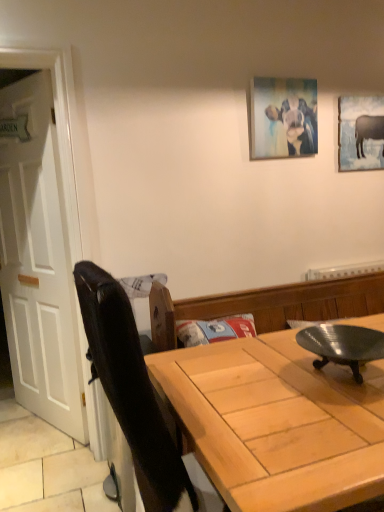
What do you see at coordinates (283, 118) in the screenshot? Image resolution: width=384 pixels, height=512 pixels. I see `matte canvas painting at upper center, acting as the 1th picture frame starting from the front` at bounding box center [283, 118].

This screenshot has height=512, width=384. Describe the element at coordinates (360, 133) in the screenshot. I see `matte gray cow at upper right, the second picture frame in the left-to-right sequence` at that location.

Image resolution: width=384 pixels, height=512 pixels. Find the location of `matte canvas painting at upper center, positioned as the 1th picture frame in left-to-right order`. matte canvas painting at upper center, positioned as the 1th picture frame in left-to-right order is located at coordinates (283, 118).

The image size is (384, 512). I want to click on desk on the right of white wooden door at left, so click(277, 423).

From a real-world perspective, which is physically above, white wooden door at left or light wood table at center?

white wooden door at left.

Does white wooden door at left have a larger size compared to light wood table at center?

No, white wooden door at left is not bigger than light wood table at center.

Is the surface of white wooden door at left in direct contact with light wood table at center?

There is a gap between white wooden door at left and light wood table at center.

Would you say metallic silver plate at center is inside or outside matte gray cow at upper right, the first picture frame from the right?

metallic silver plate at center is located beyond the bounds of matte gray cow at upper right, the first picture frame from the right.

Which object is more forward, metallic silver plate at center or matte gray cow at upper right, which appears as the second picture frame when viewed from the front?

metallic silver plate at center.

Can you confirm if metallic silver plate at center is positioned to the left of matte gray cow at upper right, the 1th picture frame in the back-to-front sequence?

Yes, metallic silver plate at center is to the left of matte gray cow at upper right, the 1th picture frame in the back-to-front sequence.

From the image's perspective, between metallic silver plate at center and matte gray cow at upper right, the first picture frame from the right, who is located below?

metallic silver plate at center, from the image's perspective.

In the scene shown: Does metallic silver plate at center turn towards light wood table at center?

No, metallic silver plate at center is not turned towards light wood table at center.

Could light wood table at center be considered to be inside metallic silver plate at center?

No, light wood table at center is located outside of metallic silver plate at center.

From the picture: Considering the sizes of objects metallic silver plate at center and light wood table at center in the image provided, who is shorter, metallic silver plate at center or light wood table at center?

Standing shorter between the two is metallic silver plate at center.

In terms of width, does metallic silver plate at center look wider or thinner when compared to light wood table at center?

In the image, metallic silver plate at center appears to be more narrow than light wood table at center.

Is matte gray cow at upper right, the 1th picture frame in the back-to-front sequence, at the back of white wooden door at left?

white wooden door at left is not turned away from matte gray cow at upper right, the 1th picture frame in the back-to-front sequence.

From the image's perspective, would you say white wooden door at left is shown under matte gray cow at upper right, which appears as the second picture frame when viewed from the front?

Yes.

Based on the photo, who is taller, white wooden door at left or matte gray cow at upper right, the first picture frame from the right?

white wooden door at left.

How many degrees apart are the facing directions of light wood table at center and metallic silver plate at center?

1.93 degrees.

Is point (298, 502) positioned in front of point (339, 324)?

Yes.

Is light wood table at center with metallic silver plate at center?

No, light wood table at center is not with metallic silver plate at center.

Looking at this image, from a real-world perspective, which object stands above the other?

From a 3D spatial view, metallic silver plate at center is above.

Looking at this image, can you confirm if light wood table at center is bigger than white wooden door at left?

Yes, light wood table at center is bigger than white wooden door at left.

From the image's perspective, does light wood table at center appear higher than white wooden door at left?

No, from the image's perspective, light wood table at center is not on top of white wooden door at left.

In the scene shown: Is light wood table at center far away from white wooden door at left?

Yes.

Does light wood table at center lie behind white wooden door at left?

No, it is not.

Locate an element on the screen. This screenshot has width=384, height=512. round table below the matte canvas painting at upper center, acting as the 1th picture frame starting from the front (from the image's perspective) is located at coordinates (342, 345).

How many degrees apart are the facing directions of metallic silver plate at center and matte canvas painting at upper center, positioned as the 2th picture frame in right-to-left order?

The angular difference between metallic silver plate at center and matte canvas painting at upper center, positioned as the 2th picture frame in right-to-left order, is 0.257 degrees.

From the image's perspective, which one is positioned higher, metallic silver plate at center or matte canvas painting at upper center, acting as the 1th picture frame starting from the front?

matte canvas painting at upper center, acting as the 1th picture frame starting from the front.

What are the coordinates of `desk in front of the white wooden door at left` in the screenshot? It's located at (277, 423).

What are the coordinates of `round table located on the left of matte gray cow at upper right, the first picture frame from the right` in the screenshot? It's located at (342, 345).

Which object lies nearer to the anchor point white wooden door at left, light wood table at center or matte gray cow at upper right, the second picture frame in the left-to-right sequence?

light wood table at center.

When comparing their distances from matte canvas painting at upper center, marked as the 2th picture frame in a back-to-front arrangement, does metallic silver plate at center or light wood table at center seem closer?

metallic silver plate at center lies closer to matte canvas painting at upper center, marked as the 2th picture frame in a back-to-front arrangement, than the other object.

Consider the image. Looking at the image, which one is located closer to matte gray cow at upper right, the 1th picture frame in the back-to-front sequence, light wood table at center or matte canvas painting at upper center, marked as the 2th picture frame in a back-to-front arrangement?

matte canvas painting at upper center, marked as the 2th picture frame in a back-to-front arrangement, is positioned closer to the anchor matte gray cow at upper right, the 1th picture frame in the back-to-front sequence.

Looking at the image, which one is located further to metallic silver plate at center, white wooden door at left or matte gray cow at upper right, the second picture frame in the left-to-right sequence?

Based on the image, white wooden door at left appears to be further to metallic silver plate at center.

When comparing their distances from light wood table at center, does metallic silver plate at center or matte gray cow at upper right, the 1th picture frame in the back-to-front sequence, seem closer?

metallic silver plate at center.

From the image, which object appears to be nearer to metallic silver plate at center, light wood table at center or matte canvas painting at upper center, marked as the 2th picture frame in a back-to-front arrangement?

light wood table at center.

Estimate the real-world distances between objects in this image. Which object is further from matte gray cow at upper right, the first picture frame from the right, matte canvas painting at upper center, marked as the 2th picture frame in a back-to-front arrangement, or light wood table at center?

light wood table at center is positioned further to the anchor matte gray cow at upper right, the first picture frame from the right.

From the image, which object appears to be farther from white wooden door at left, light wood table at center or matte canvas painting at upper center, marked as the 2th picture frame in a back-to-front arrangement?

light wood table at center lies further to white wooden door at left than the other object.

Locate an element on the screen. The width and height of the screenshot is (384, 512). desk between white wooden door at left and matte gray cow at upper right, the 1th picture frame in the back-to-front sequence, from left to right is located at coordinates (277, 423).

Find the location of a particular element. The image size is (384, 512). round table between light wood table at center and matte gray cow at upper right, the 1th picture frame in the back-to-front sequence, along the z-axis is located at coordinates (342, 345).

The image size is (384, 512). In order to click on picture frame located between metallic silver plate at center and matte gray cow at upper right, the first picture frame from the right, in the depth direction in this screenshot , I will do `click(283, 118)`.

Where is `round table between white wooden door at left and matte gray cow at upper right, the 1th picture frame in the back-to-front sequence`? round table between white wooden door at left and matte gray cow at upper right, the 1th picture frame in the back-to-front sequence is located at coordinates (342, 345).